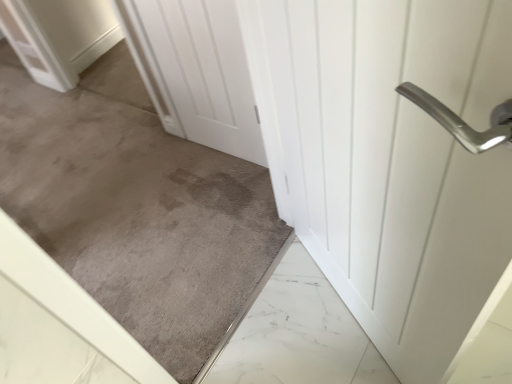
Question: From the image's perspective, is white matte door at center, the 2th door positioned from the right, positioned above or below gray carpet at center?

Choices:
 (A) below
 (B) above

Answer: (B)

Question: In the image, is white matte door at center, the 2th door positioned from the right, positioned in front of or behind gray carpet at center?

Choices:
 (A) behind
 (B) front

Answer: (A)

Question: Estimate the real-world distances between objects in this image. Which object is closer to the white glossy door handle at upper right, the first door when ordered from right to left?

Choices:
 (A) white matte door at center, arranged as the 1th door when viewed from the left
 (B) gray carpet at center

Answer: (A)

Question: Based on their relative distances, which object is nearer to the white matte door at center, arranged as the 1th door when viewed from the left?

Choices:
 (A) white glossy door handle at upper right, the second door when ordered from left to right
 (B) gray carpet at center

Answer: (B)